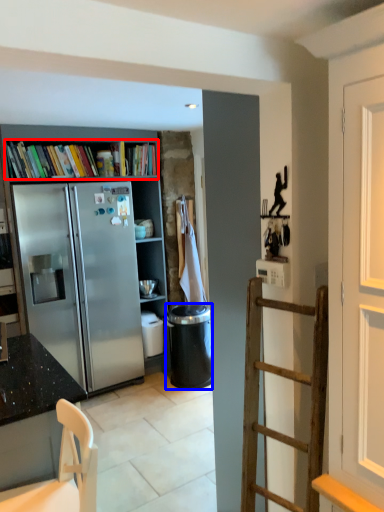
Question: Which point is closer to the camera, book (highlighted by a red box) or trash bin/can (highlighted by a blue box)?

Choices:
 (A) book
 (B) trash bin/can

Answer: (A)